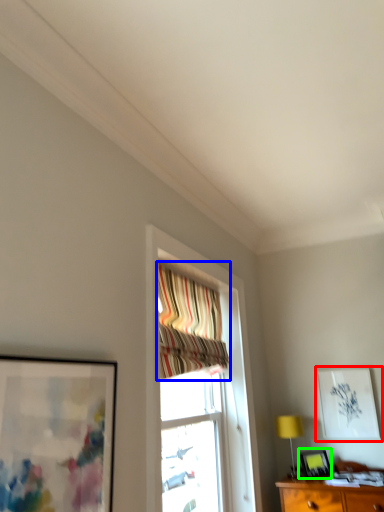
Question: Which object is the farthest from picture frame (highlighted by a red box)? Choose among these: curtain (highlighted by a blue box) or picture frame (highlighted by a green box).

Choices:
 (A) curtain
 (B) picture frame

Answer: (A)